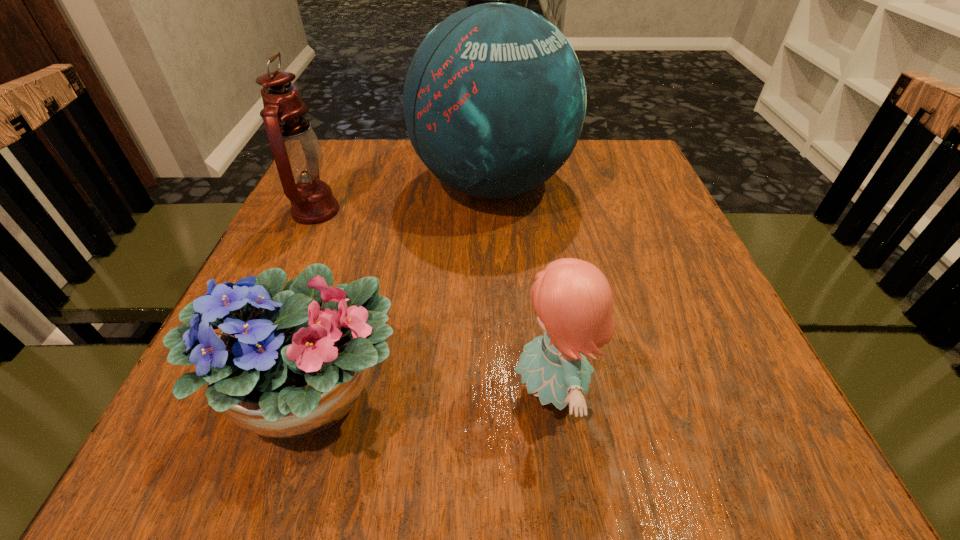
This screenshot has width=960, height=540. Identify the location of object positioned at the far edge. (494, 100).

Identify the location of doll that is at the near edge. The height and width of the screenshot is (540, 960). (573, 300).

Where is `bouquet situated at the near edge`? bouquet situated at the near edge is located at coordinates (291, 364).

Identify the location of oil lamp that is at the left edge. (297, 152).

Locate an element on the screen. This screenshot has width=960, height=540. bouquet positioned at the left edge is located at coordinates (291, 364).

The image size is (960, 540). I want to click on object located at the near left corner, so click(291, 364).

You are a GUI agent. You are given a task and a screenshot of the screen. Output one action in this format:
    pyautogui.click(x=<x>, y=<y>)
    Task: Click on the free space at the near edge of the desktop
    
    Given the screenshot: What is the action you would take?
    click(498, 450)

Where is `vacant space at the right edge of the desktop`? This screenshot has height=540, width=960. vacant space at the right edge of the desktop is located at coordinates (606, 225).

In the image, there is a desktop. In order to click on vacant space at the near left corner in this screenshot , I will do `click(251, 455)`.

Where is `vacant space at the far right corner`? vacant space at the far right corner is located at coordinates click(620, 170).